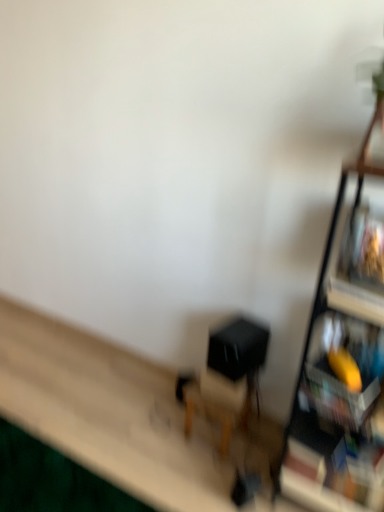
Question: From the image's perspective, is matte black swivel chair at center beneath wooden shelf at right?

Choices:
 (A) no
 (B) yes

Answer: (B)

Question: From the image's perspective, is matte black swivel chair at center on wooden shelf at right?

Choices:
 (A) yes
 (B) no

Answer: (B)

Question: Is matte black swivel chair at center beside wooden shelf at right?

Choices:
 (A) yes
 (B) no

Answer: (B)

Question: Considering the relative sizes of matte black swivel chair at center and wooden shelf at right in the image provided, is matte black swivel chair at center smaller than wooden shelf at right?

Choices:
 (A) no
 (B) yes

Answer: (B)

Question: Considering the relative sizes of matte black swivel chair at center and wooden shelf at right in the image provided, is matte black swivel chair at center bigger than wooden shelf at right?

Choices:
 (A) no
 (B) yes

Answer: (A)

Question: From a real-world perspective, is matte black swivel chair at center physically below wooden shelf at right?

Choices:
 (A) yes
 (B) no

Answer: (A)

Question: Can you confirm if wooden shelf at right is shorter than matte black swivel chair at center?

Choices:
 (A) yes
 (B) no

Answer: (B)

Question: Are wooden shelf at right and matte black swivel chair at center located far from each other?

Choices:
 (A) yes
 (B) no

Answer: (B)

Question: Is wooden shelf at right further to the viewer compared to matte black swivel chair at center?

Choices:
 (A) yes
 (B) no

Answer: (B)

Question: Considering the relative sizes of wooden shelf at right and matte black swivel chair at center in the image provided, is wooden shelf at right smaller than matte black swivel chair at center?

Choices:
 (A) no
 (B) yes

Answer: (A)

Question: Is wooden shelf at right oriented away from matte black swivel chair at center?

Choices:
 (A) no
 (B) yes

Answer: (A)

Question: From the image's perspective, would you say wooden shelf at right is shown under matte black swivel chair at center?

Choices:
 (A) no
 (B) yes

Answer: (A)

Question: In terms of size, does wooden shelf at right appear bigger or smaller than matte black swivel chair at center?

Choices:
 (A) small
 (B) big

Answer: (B)